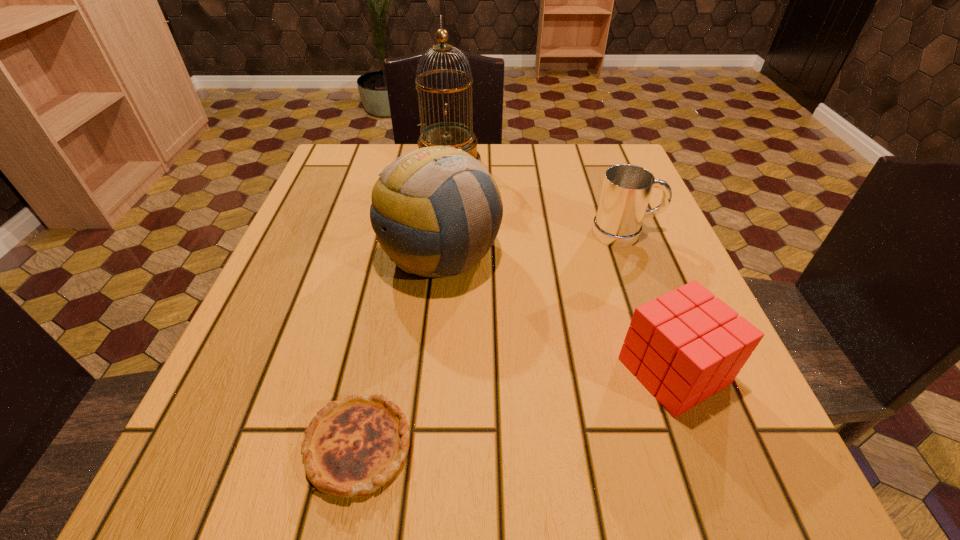
The width and height of the screenshot is (960, 540). In order to click on the tallest object in this screenshot , I will do `click(460, 136)`.

At what (x,y) coordinates should I click in order to perform the action: click on the farthest object. Please return your answer as a coordinate pair (x, y). This screenshot has width=960, height=540. Looking at the image, I should click on (460, 136).

Identify the location of volleyball. The width and height of the screenshot is (960, 540). (436, 211).

This screenshot has height=540, width=960. What are the coordinates of `mug` in the screenshot? It's located at (626, 191).

Locate an element on the screen. cube is located at coordinates (686, 345).

Find the location of a particular element. This screenshot has height=540, width=960. the shortest object is located at coordinates (351, 448).

Find the location of a particular element. free space located with an open door on the farthest object is located at coordinates (505, 164).

Identify the location of vacant region located 0.200m on the back of the fourth shortest object. (449, 170).

The width and height of the screenshot is (960, 540). I want to click on free region located 0.200m on the left of the cube, so click(x=489, y=371).

The height and width of the screenshot is (540, 960). Identify the location of vacant position located on the right of the quiche. (570, 447).